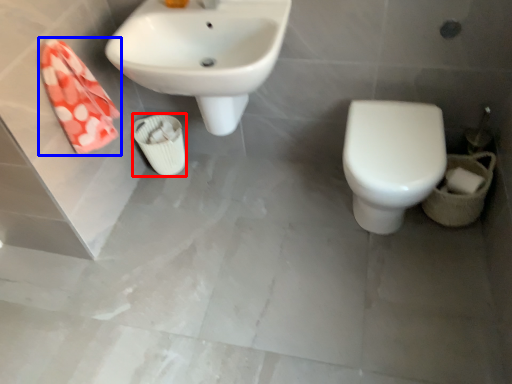
Question: Which object appears farthest to the camera in this image, porcelain (highlighted by a red box) or hand towel (highlighted by a blue box)?

Choices:
 (A) porcelain
 (B) hand towel

Answer: (A)